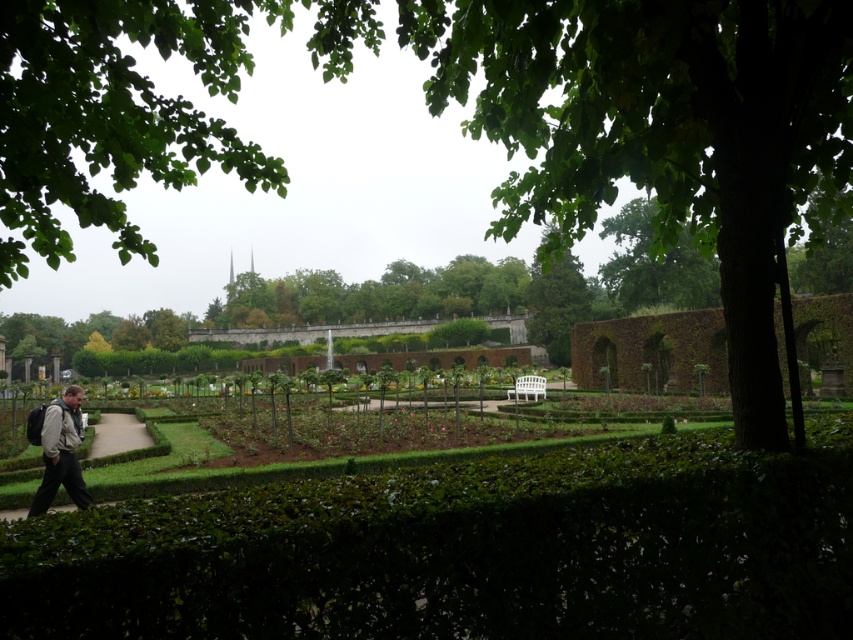
Does green leafy tree at center have a greater width compared to light brown leather jacket at lower left?

Yes.

Between green leafy tree at center and light brown leather jacket at lower left, which one has less height?

light brown leather jacket at lower left is shorter.

Who is more distant from viewer, (552, 356) or (44, 435)?

The point (552, 356) is more distant.

The width and height of the screenshot is (853, 640). Identify the location of green leafy tree at center. (556, 305).